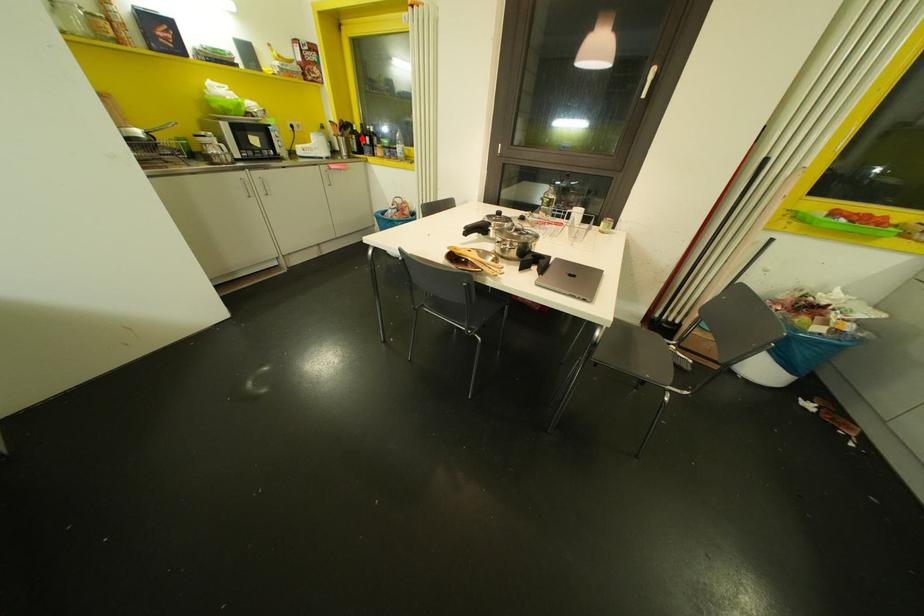
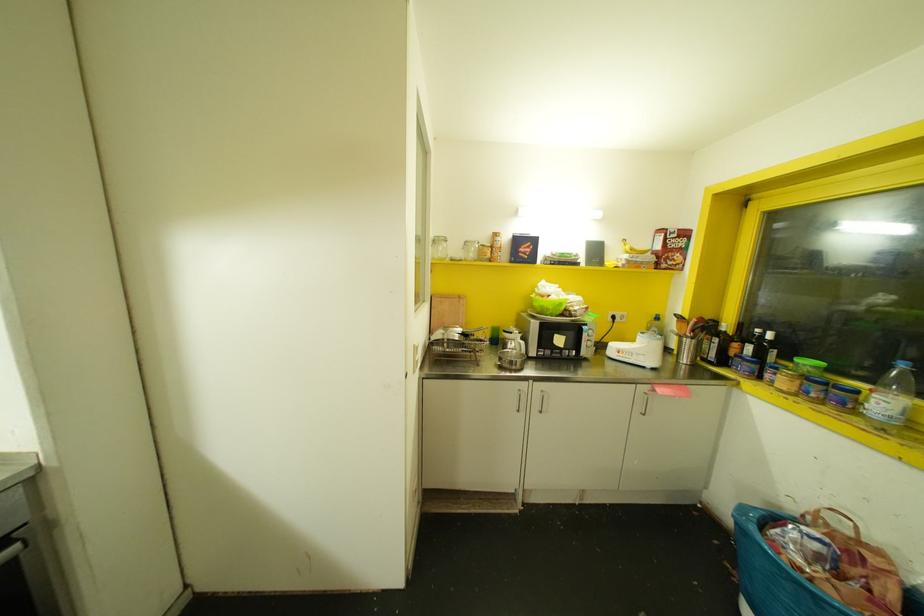
Question: I am providing you with two images of the same scene from different viewpoints. In image1, a red point is highlighted. Considering the same 3D point in image2, which of the following is correct?

Choices:
 (A) It is closer
 (B) It is farther

Answer: (B)